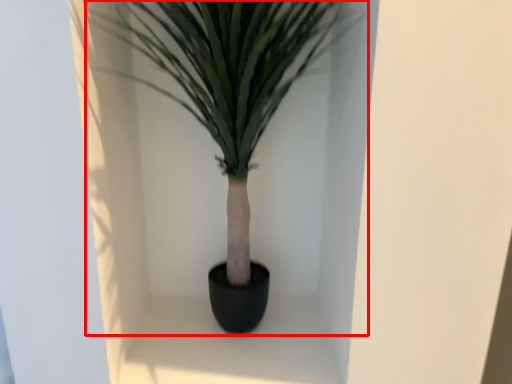
Question: Observing the image, what is the correct spatial positioning of houseplant (annotated by the red box) in reference to window sill?

Choices:
 (A) right
 (B) left

Answer: (B)